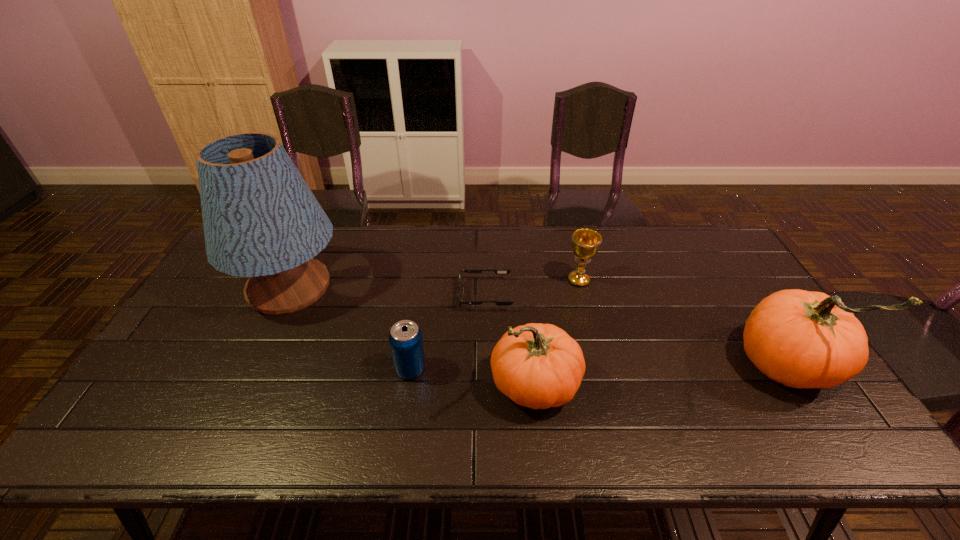
Where is `object that is at the right edge`? object that is at the right edge is located at coordinates (801, 339).

Where is `object present at the far left corner`? The image size is (960, 540). object present at the far left corner is located at coordinates (261, 220).

Where is `object that is at the near right corner`? Image resolution: width=960 pixels, height=540 pixels. object that is at the near right corner is located at coordinates (801, 339).

Image resolution: width=960 pixels, height=540 pixels. I want to click on free region at the far edge, so click(x=353, y=244).

You are a GUI agent. You are given a task and a screenshot of the screen. Output one action in this format:
    pyautogui.click(x=<x>, y=<y>)
    Task: Click on the vacant space at the near edge of the desktop
    The image size is (960, 540).
    Given the screenshot: What is the action you would take?
    pyautogui.click(x=389, y=402)

Find the location of a particular element. This screenshot has height=540, width=960. vacant space at the right edge of the desktop is located at coordinates (751, 300).

In the image, there is a desktop. Identify the location of blank space at the near left corner. (189, 400).

In order to click on free spot at the far right corner of the desktop in this screenshot , I will do (x=701, y=251).

Where is `free space between the fifth object from right to left and the rightmost object`? The height and width of the screenshot is (540, 960). free space between the fifth object from right to left and the rightmost object is located at coordinates (599, 368).

Find the location of a particular element. vacant point located between the fifth object from left to right and the second object from left to right is located at coordinates (494, 325).